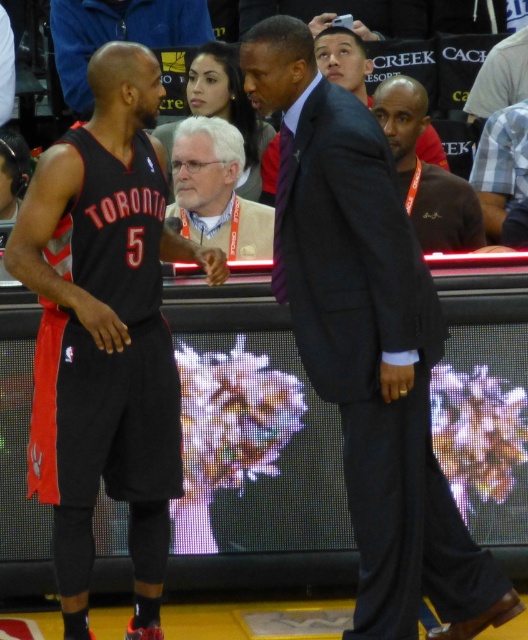
Between matte black jersey at left and white textured shirt at center, which one has more height?

With more height is matte black jersey at left.

Is matte black jersey at left in front of white textured shirt at center?

Yes, matte black jersey at left is closer to the viewer.

Where is `matte black jersey at left`? The height and width of the screenshot is (640, 528). matte black jersey at left is located at coordinates (106, 333).

Which is more to the right, dark brown suit at center or blue plaid shirt at right?

blue plaid shirt at right

Is dark brown suit at center bigger than blue plaid shirt at right?

No, dark brown suit at center is not bigger than blue plaid shirt at right.

Locate an element on the screen. dark brown suit at center is located at coordinates (427, 172).

Where is `dark brown suit at center`? The width and height of the screenshot is (528, 640). dark brown suit at center is located at coordinates (427, 172).

Which is below, white textured shirt at center or dark brown suit at center?

white textured shirt at center is lower down.

Can you confirm if white textured shirt at center is positioned to the right of dark brown suit at center?

In fact, white textured shirt at center is to the left of dark brown suit at center.

Is point (254, 202) positioned in front of point (374, 93)?

Yes, it is in front of point (374, 93).

Locate an element on the screen. The height and width of the screenshot is (640, 528). white textured shirt at center is located at coordinates (215, 189).